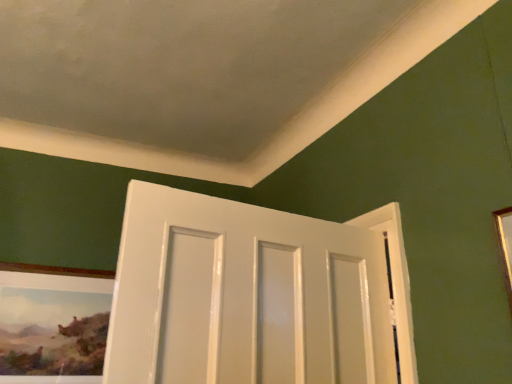
Question: Should I look upward or downward to see wooden framed painting at lower left?

Choices:
 (A) up
 (B) down

Answer: (B)